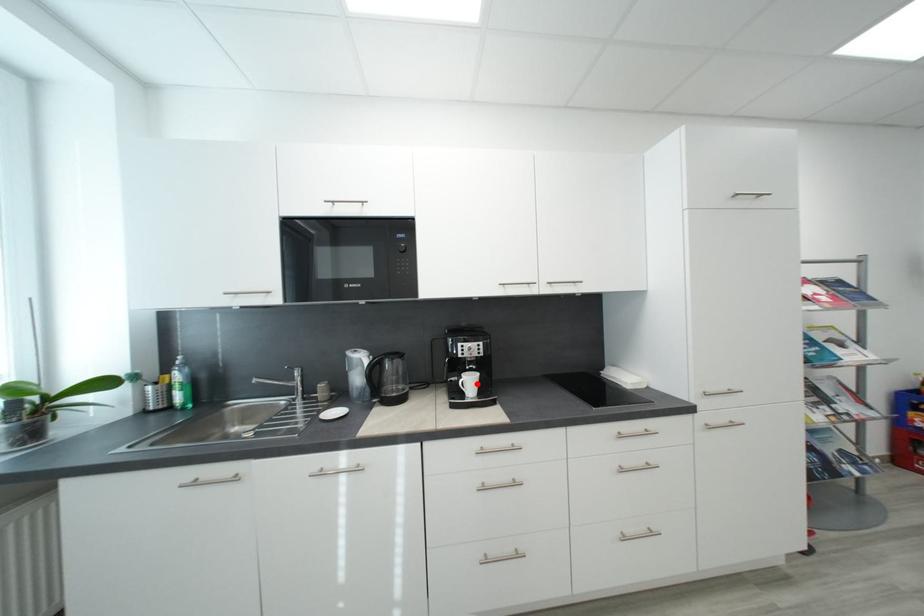
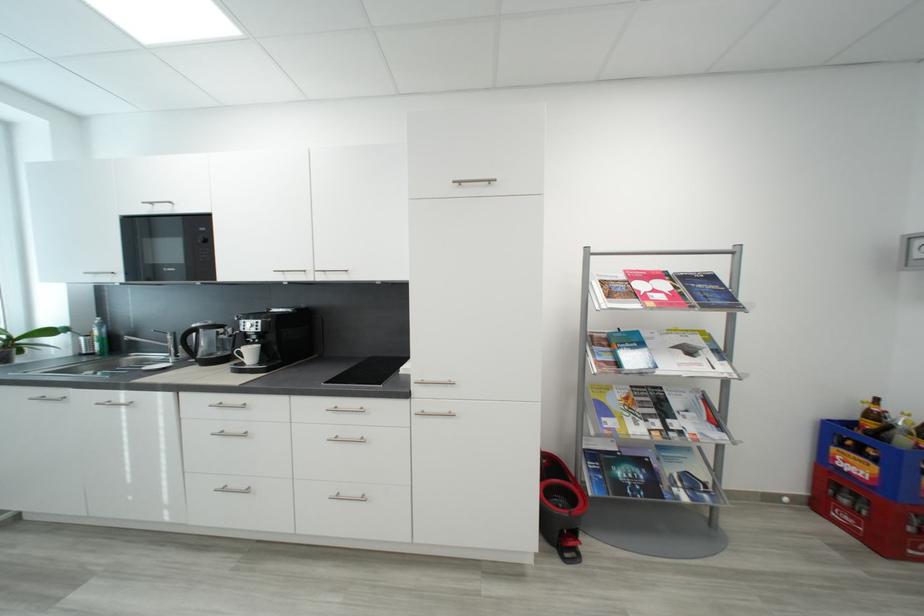
Where in the second image is the point corresponding to the highlighted location from the first image?

(257, 354)